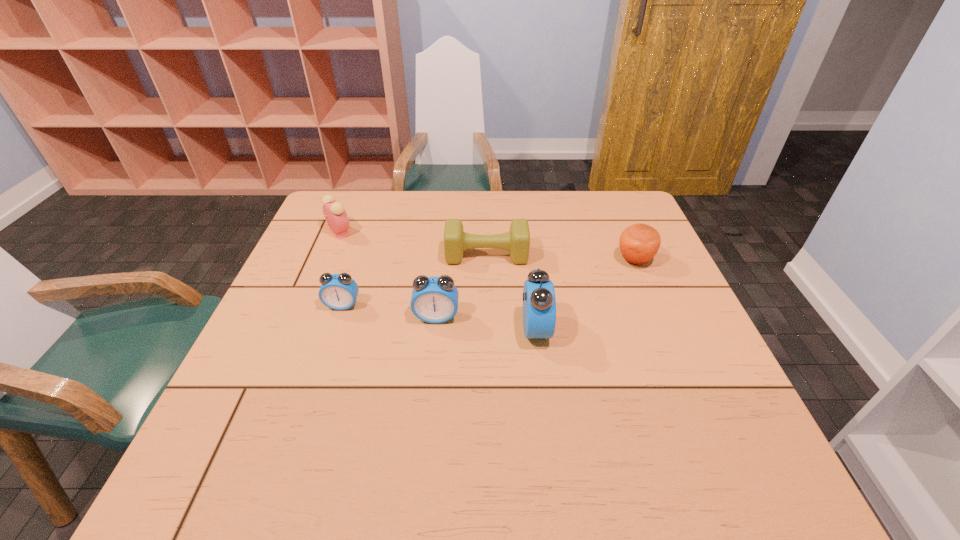
Locate an element on the screen. This screenshot has height=540, width=960. vacant area located 0.380m on the face of the farthest alarm clock is located at coordinates pos(481,232).

Where is `object situated at the far edge`? The image size is (960, 540). object situated at the far edge is located at coordinates (336, 217).

Locate an element on the screen. This screenshot has width=960, height=540. object that is at the right edge is located at coordinates (639, 243).

In order to click on object that is at the far left corner in this screenshot , I will do `click(336, 217)`.

I want to click on vacant space at the far edge of the desktop, so click(x=543, y=200).

In the image, there is a desktop. Where is `vacant space at the left edge`? Image resolution: width=960 pixels, height=540 pixels. vacant space at the left edge is located at coordinates (292, 383).

The width and height of the screenshot is (960, 540). In the image, there is a desktop. What are the coordinates of `free space at the right edge` in the screenshot? It's located at [638, 289].

Where is `blank area at the far right corner`? blank area at the far right corner is located at coordinates (622, 225).

This screenshot has height=540, width=960. Find the location of `vacant region at the near right corner`. vacant region at the near right corner is located at coordinates (710, 400).

Identify the location of vacant area that lies between the second alarm clock from right to left and the rightmost alarm clock. Image resolution: width=960 pixels, height=540 pixels. (486, 323).